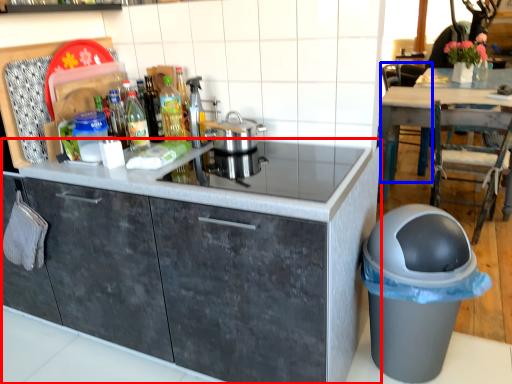
Question: Which object appears closest to the camera in this image, cabinetry (highlighted by a red box) or chair (highlighted by a blue box)?

Choices:
 (A) cabinetry
 (B) chair

Answer: (A)